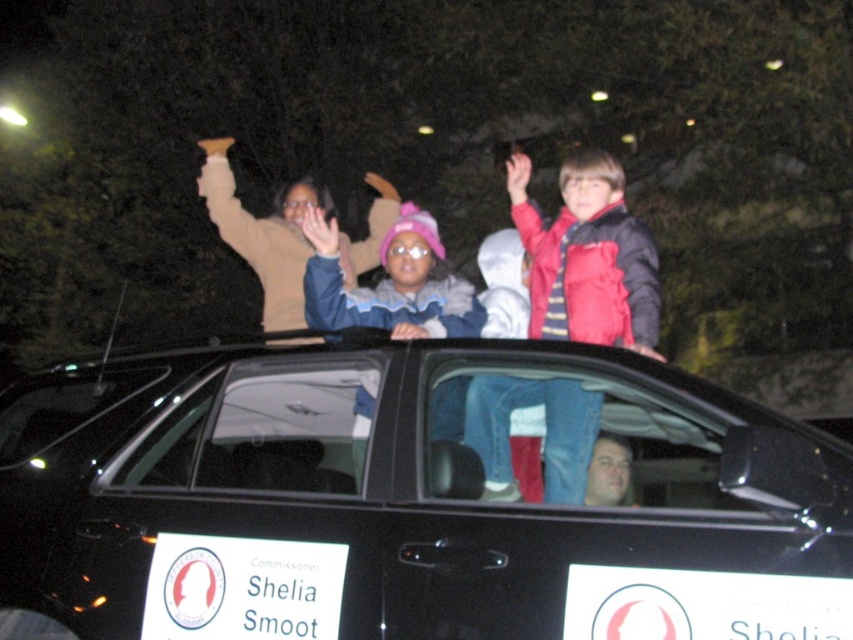
Based on the photo, you are standing in front of the car with the Shelia Smoot sign. There are two points marked on the car. The first point is at coordinate (358, 618) and the second point is at (506, 448). Which point is closer to you?

The point at coordinate (358, 618) is closer to the viewer than the point at (506, 448).

You are a photographer at the event and want to capture both the red fleece jacket at upper right and the blue fleece jacket at center in a single photo. Which jacket should you focus on first to ensure both are in frame?

You should focus on the blue fleece jacket at center first because it is larger than the red fleece jacket at upper right, allowing you to frame it properly while still capturing the smaller jacket in the shot.